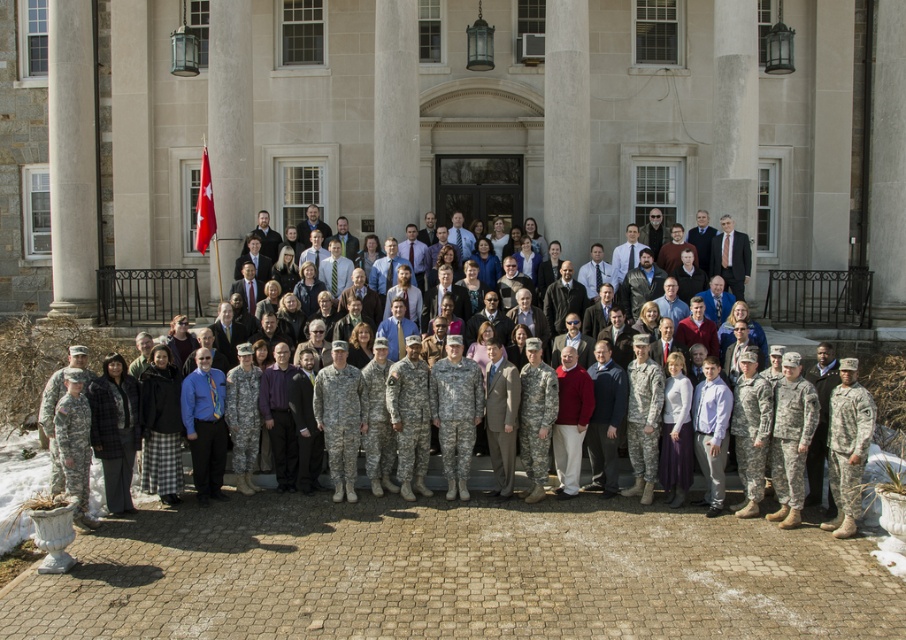
Question: Observing the image, what is the correct spatial positioning of camouflage uniform at center in reference to camouflage fabric skirt at lower center?

Choices:
 (A) below
 (B) above

Answer: (A)

Question: Which point is farther to the camera?

Choices:
 (A) camouflage fabric skirt at lower center
 (B) camouflage uniform at center

Answer: (A)

Question: Is camouflage uniform at center to the right of camouflage fabric skirt at lower center from the viewer's perspective?

Choices:
 (A) no
 (B) yes

Answer: (B)

Question: Which of the following is the farthest from the observer?

Choices:
 (A) (149, 490)
 (B) (651, 464)

Answer: (B)

Question: Can you confirm if camouflage uniform at center is positioned above camouflage fabric skirt at lower center?

Choices:
 (A) yes
 (B) no

Answer: (B)

Question: Which of the following is the farthest from the observer?

Choices:
 (A) camouflage fabric skirt at lower center
 (B) camouflage uniform at center

Answer: (A)